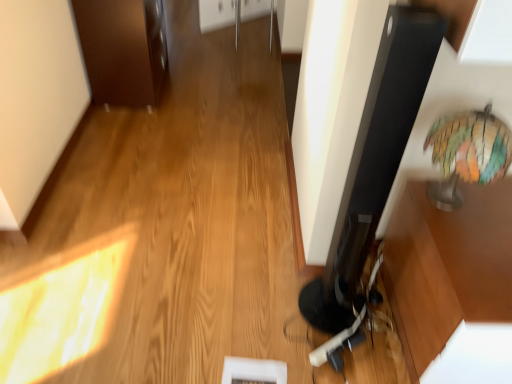
Question: From the image's perspective, is brown wood cabinet at upper left positioned above or below multicolored glass globe at right?

Choices:
 (A) below
 (B) above

Answer: (B)

Question: Visually, is brown wood cabinet at upper left positioned to the left or to the right of multicolored glass globe at right?

Choices:
 (A) right
 (B) left

Answer: (B)

Question: In the image, is brown wood cabinet at upper left positioned in front of or behind multicolored glass globe at right?

Choices:
 (A) front
 (B) behind

Answer: (B)

Question: Is point (489, 145) closer or farther from the camera than point (160, 4)?

Choices:
 (A) farther
 (B) closer

Answer: (B)

Question: Is multicolored glass globe at right taller or shorter than brown wood cabinet at upper left?

Choices:
 (A) tall
 (B) short

Answer: (B)

Question: Considering their positions, is multicolored glass globe at right located in front of or behind brown wood cabinet at upper left?

Choices:
 (A) behind
 (B) front

Answer: (B)

Question: Is multicolored glass globe at right inside the boundaries of brown wood cabinet at upper left, or outside?

Choices:
 (A) outside
 (B) inside

Answer: (A)